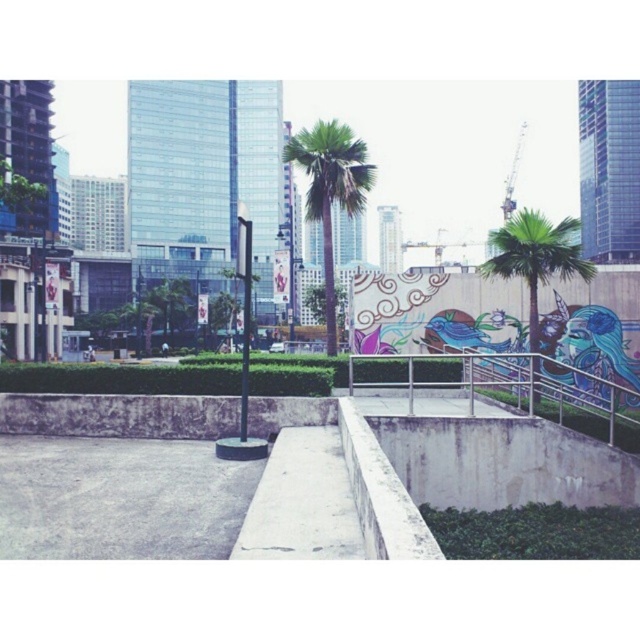
You are a gardener who needs to trim both the green leafy palm at center and the green leafy palm tree at right. Which palm tree should you start with if you want to work from the closest to the farthest from your current position?

You should start with the green leafy palm tree at right because the green leafy palm at center is positioned over it, meaning the palm tree at right is closer to you than the one at center.

You are standing at the center of the image and want to walk directly towards the green leafy palm at center. Which direction should you move?

Since the green leafy palm at center is located at the center of the image, you are already facing it directly. Therefore, you should move straight ahead to reach it.